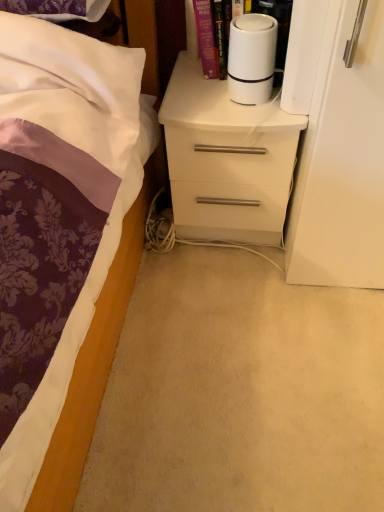
What are the coordinates of `vacant area that is in front of white matte cylindrical object at upper center` in the screenshot? It's located at click(x=253, y=118).